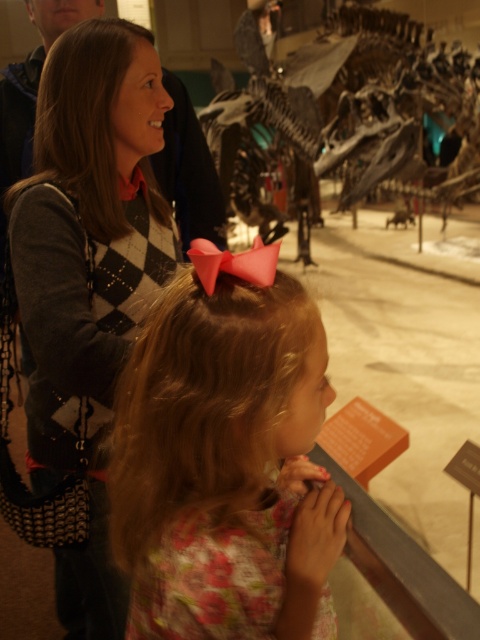
You are a photographer trying to capture a photo of the argyle sweater at upper left without the pink satin bow at center blocking it. What should you do?

Move to the side so that the pink satin bow at center is no longer in front of the argyle sweater at upper left.

You are standing in the museum looking at the dinosaur exhibit. There are two points marked in the image. The first point is at coordinates point (226,275) and the second point is at point (376,141). Which point is closer to you?

Point (226,275) is closer to the camera than point (376,141).

You are a museum guide who needs to point out the pink satin bow at center to a visitor. Based on the coordinates provided in the Objects Description, can you confirm if the bow is positioned to the left or right of the center point of the image?

The pink satin bow at center is located at coordinates point (225, 460). Since the x coordinate 0.719 is greater than 0.5, it is positioned to the right of the center point of the image.